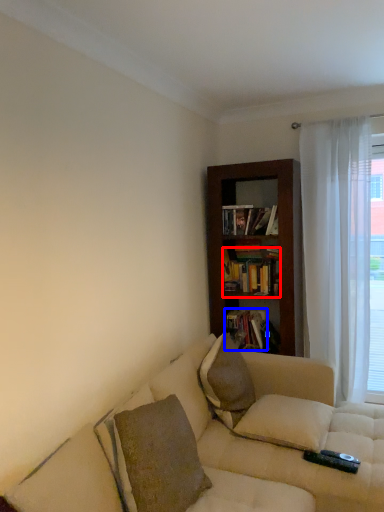
Question: Which object is further to the camera taking this photo, book (highlighted by a red box) or book (highlighted by a blue box)?

Choices:
 (A) book
 (B) book

Answer: (B)